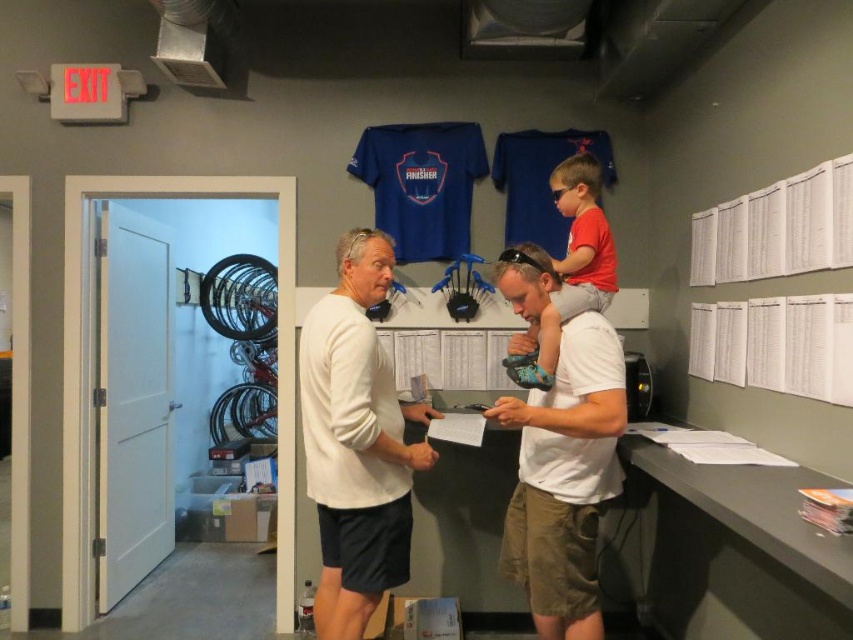
Question: Can you confirm if white matte long-sleeve shirt at center is smaller than matte red shirt at upper center?

Choices:
 (A) no
 (B) yes

Answer: (A)

Question: Considering the real-world distances, which object is farthest from the white matte long-sleeve shirt at center?

Choices:
 (A) white cotton shirt at center
 (B) matte red shirt at upper center

Answer: (B)

Question: Among these objects, which one is farthest from the camera?

Choices:
 (A) matte red shirt at upper center
 (B) white matte long-sleeve shirt at center

Answer: (A)

Question: Is white matte long-sleeve shirt at center wider than matte red shirt at upper center?

Choices:
 (A) no
 (B) yes

Answer: (B)

Question: Can you confirm if white matte long-sleeve shirt at center is positioned above white cotton shirt at center?

Choices:
 (A) yes
 (B) no

Answer: (A)

Question: Which point is farther to the camera?

Choices:
 (A) (355, 243)
 (B) (552, 536)
 (C) (583, 172)

Answer: (C)